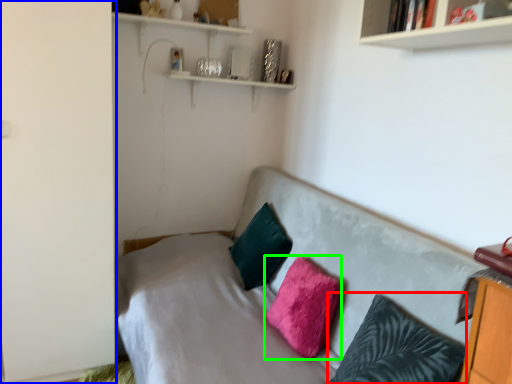
Question: Which object is positioned farthest from pillow (highlighted by a red box)? Select from side (highlighted by a blue box) and pillow (highlighted by a green box).

Choices:
 (A) side
 (B) pillow

Answer: (A)